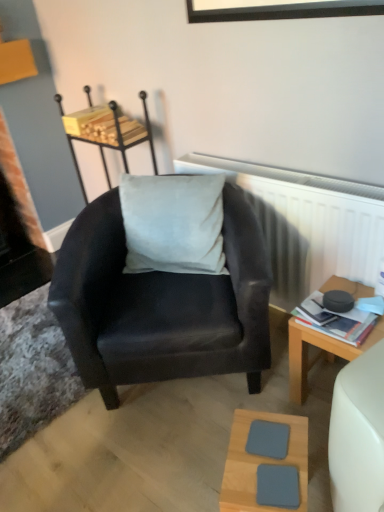
Question: From the image's perspective, is light gray fabric stool at center positioned above or below hardcover book at right?

Choices:
 (A) above
 (B) below

Answer: (A)

Question: Based on their sizes in the image, would you say light gray fabric stool at center is bigger or smaller than hardcover book at right?

Choices:
 (A) big
 (B) small

Answer: (A)

Question: Which object is positioned farthest from the light gray fabric stool at center?

Choices:
 (A) light wood/texture square coaster at lower center
 (B) white matte radiator at upper center
 (C) wooden desk at right
 (D) hardcover book at right
 (E) suede black armchair at center

Answer: (A)

Question: Based on their relative distances, which object is nearer to the suede black armchair at center?

Choices:
 (A) wooden desk at right
 (B) light gray fabric stool at center
 (C) white matte radiator at upper center
 (D) light wood/texture square coaster at lower center
 (E) hardcover book at right

Answer: (C)